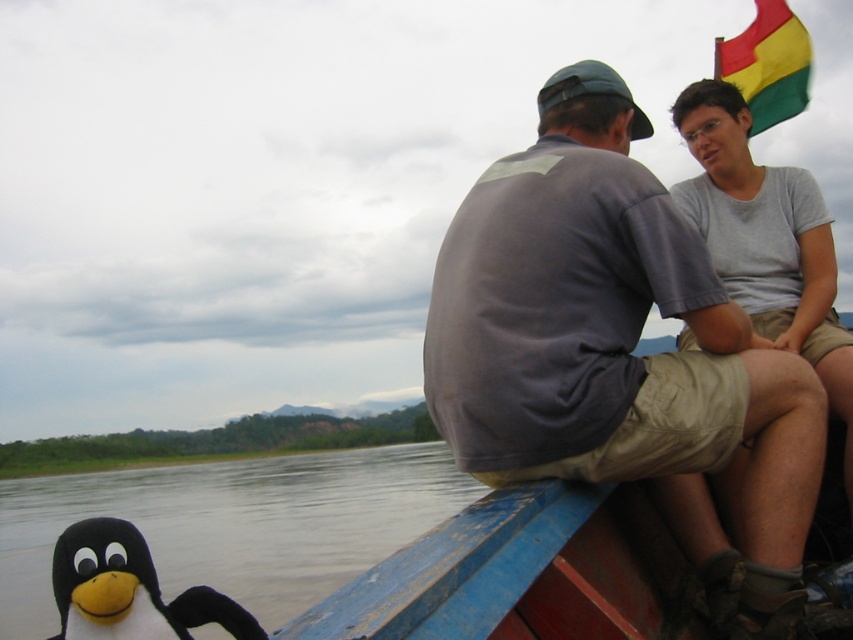
Question: Which point is closer to the camera?

Choices:
 (A) gray cotton shirt at upper right
 (B) white matte water at lower left
 (C) black plush penguin at lower left

Answer: (C)

Question: Among these points, which one is nearest to the camera?

Choices:
 (A) (782, 86)
 (B) (67, 609)

Answer: (B)

Question: Does gray cotton shirt at upper right have a greater width compared to yellow-green fabric flag at upper right?

Choices:
 (A) yes
 (B) no

Answer: (A)

Question: Is gray cotton shirt at upper right below yellow-green fabric flag at upper right?

Choices:
 (A) yes
 (B) no

Answer: (A)

Question: In this image, where is gray cotton shirt at upper right located relative to black plush penguin at lower left?

Choices:
 (A) right
 (B) left

Answer: (A)

Question: Which object is closer to the camera taking this photo?

Choices:
 (A) black plush penguin at lower left
 (B) yellow-green fabric flag at upper right
 (C) white matte water at lower left

Answer: (A)